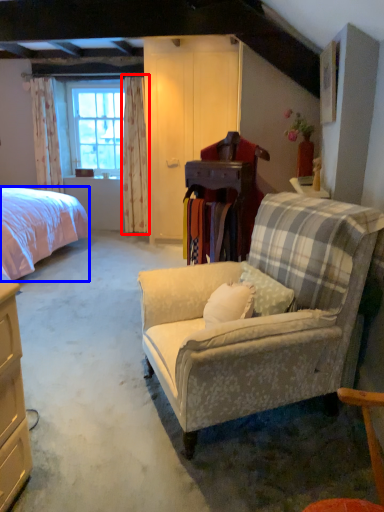
Question: Among these objects, which one is nearest to the camera, curtain (highlighted by a red box) or bed (highlighted by a blue box)?

Choices:
 (A) curtain
 (B) bed

Answer: (B)